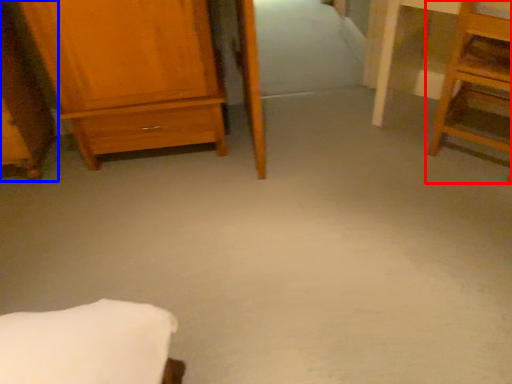
Question: Which object appears farthest to the camera in this image, furniture (highlighted by a red box) or furniture (highlighted by a blue box)?

Choices:
 (A) furniture
 (B) furniture

Answer: (B)